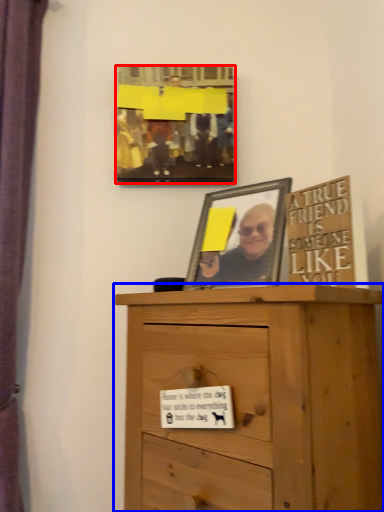
Question: Among these objects, which one is farthest to the camera, picture frame (highlighted by a red box) or chest of drawers (highlighted by a blue box)?

Choices:
 (A) picture frame
 (B) chest of drawers

Answer: (A)